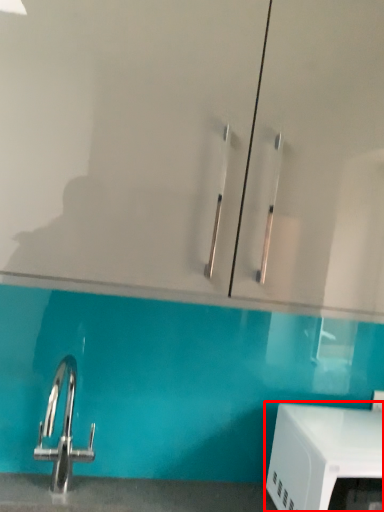
Question: In this image, where is appliance (annotated by the red box) located relative to glass door?

Choices:
 (A) left
 (B) right

Answer: (B)